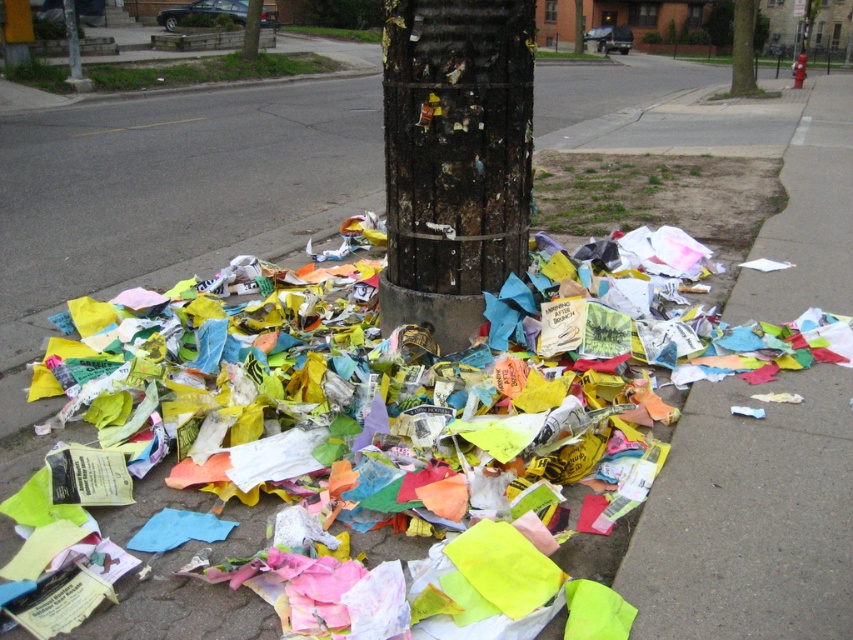
Question: Which object is positioned farthest from the paper at lower right?

Choices:
 (A) charred wood post at center
 (B) multicolored paper at center

Answer: (A)

Question: Which object appears closest to the camera in this image?

Choices:
 (A) multicolored paper at center
 (B) paper at lower right
 (C) charred wood post at center

Answer: (A)

Question: Does multicolored paper at center appear under charred wood post at center?

Choices:
 (A) yes
 (B) no

Answer: (A)

Question: Is multicolored paper at center smaller than paper at lower right?

Choices:
 (A) yes
 (B) no

Answer: (A)

Question: Does multicolored paper at center have a smaller size compared to paper at lower right?

Choices:
 (A) no
 (B) yes

Answer: (B)

Question: Which point is closer to the camera taking this photo?

Choices:
 (A) (602, 420)
 (B) (405, 243)
 (C) (781, 616)

Answer: (C)